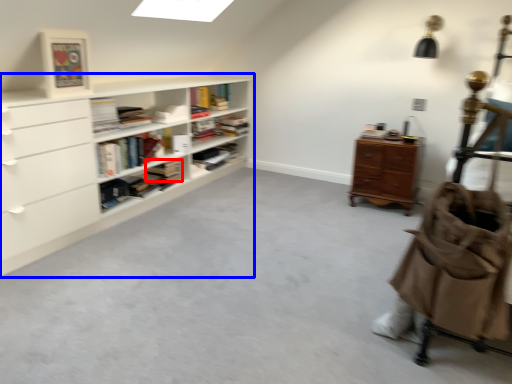
Question: Among these objects, which one is farthest to the camera, book (highlighted by a red box) or shelf (highlighted by a blue box)?

Choices:
 (A) book
 (B) shelf

Answer: (A)